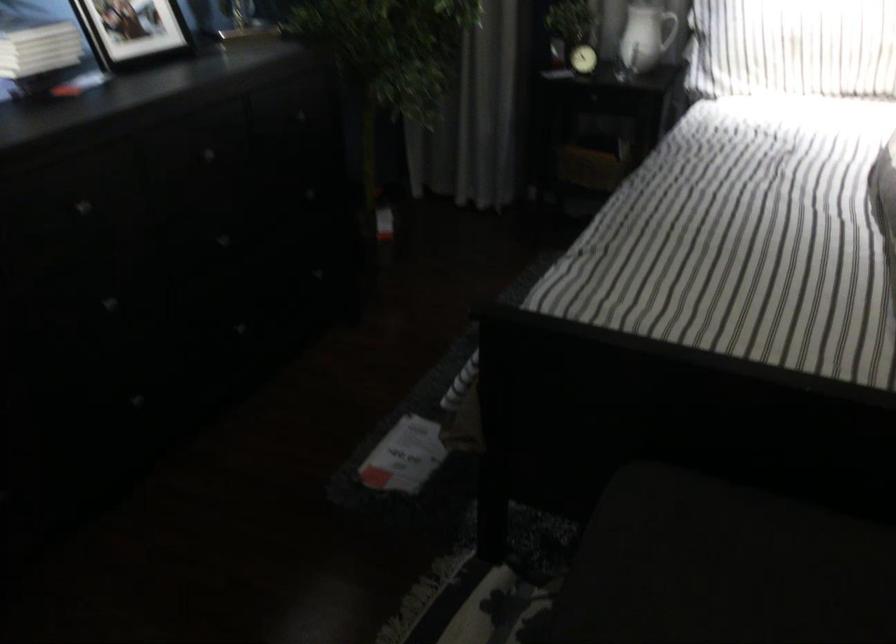
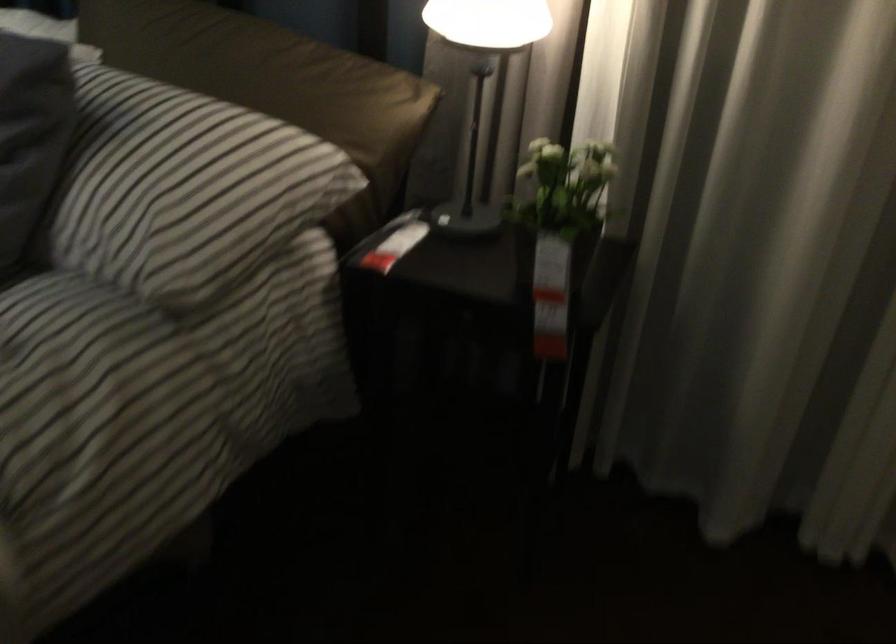
Question: What movement of the cameraman would produce the second image?

Choices:
 (A) Left
 (B) Right
 (C) Forward
 (D) Backward

Answer: (B)